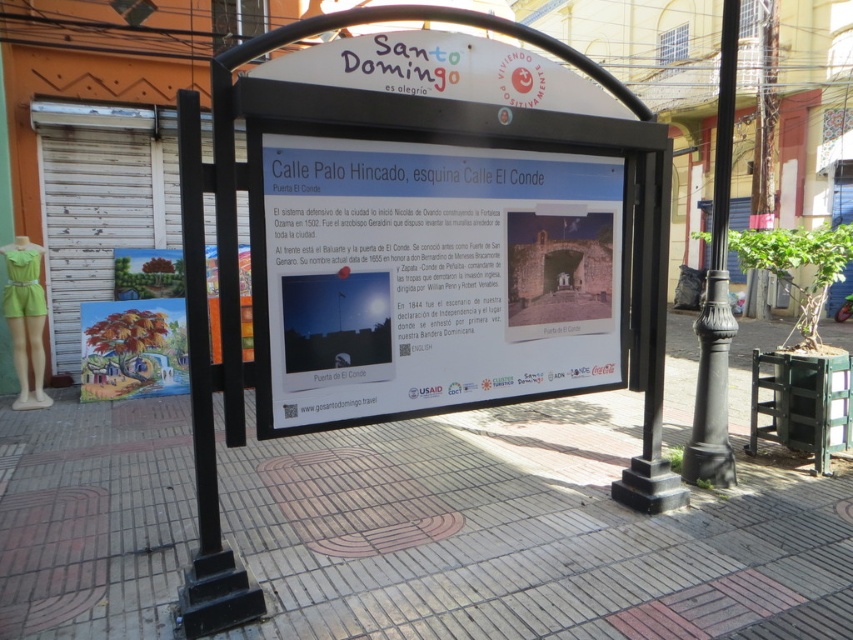
Which of these two, smooth concrete sidewalk at center or black metal sign at center, stands taller?

Standing taller between the two is black metal sign at center.

Is smooth concrete sidewalk at center wider than black metal sign at center?

Incorrect, smooth concrete sidewalk at center's width does not surpass black metal sign at center's.

Between point (503, 608) and point (466, 157), which one is positioned behind?

Point (466, 157)

Identify the location of smooth concrete sidewalk at center. The image size is (853, 640). (526, 536).

Does smooth concrete sidewalk at center lie behind white paper sign at center?

Yes, it is behind white paper sign at center.

Between smooth concrete sidewalk at center and white paper sign at center, which one appears on the right side from the viewer's perspective?

Positioned to the right is white paper sign at center.

Where is `smooth concrete sidewalk at center`? smooth concrete sidewalk at center is located at coordinates (526, 536).

Which is in front, point (602, 156) or point (701, 307)?

Point (602, 156) is in front.

Locate an element on the screen. The height and width of the screenshot is (640, 853). black metal sign at center is located at coordinates (421, 262).

Locate an element on the screen. Image resolution: width=853 pixels, height=640 pixels. black metal sign at center is located at coordinates (421, 262).

This screenshot has height=640, width=853. In order to click on black metal sign at center in this screenshot , I will do `click(421, 262)`.